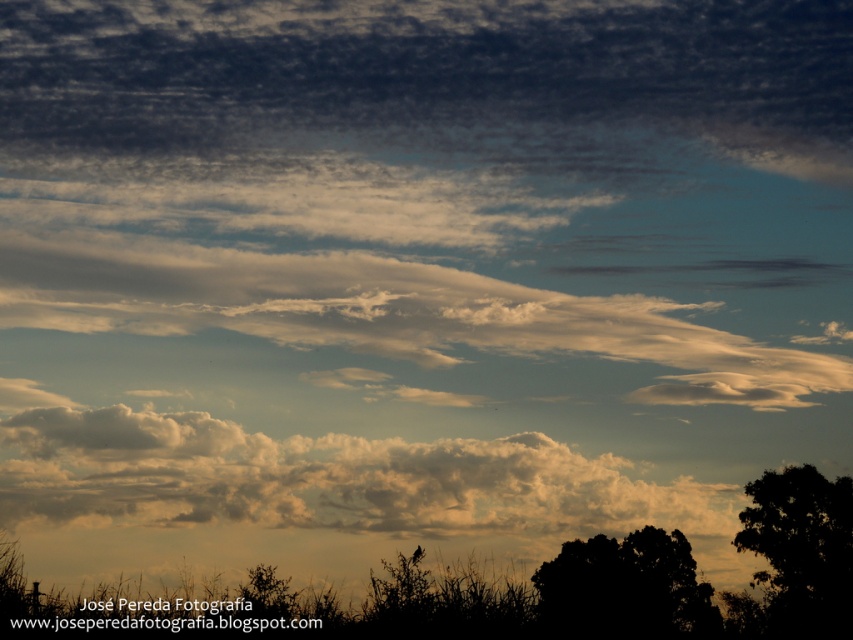
Between dark gray textured cloud at upper center and black matte tree at lower right, which one has more height?

dark gray textured cloud at upper center

Describe the element at coordinates (432, 80) in the screenshot. I see `dark gray textured cloud at upper center` at that location.

You are a GUI agent. You are given a task and a screenshot of the screen. Output one action in this format:
    pyautogui.click(x=<x>, y=<y>)
    Task: Click on the dark gray textured cloud at upper center
    
    Given the screenshot: What is the action you would take?
    pyautogui.click(x=432, y=80)

Between cloudy white at lower center and dark green leafy tree at lower right, which one appears on the left side from the viewer's perspective?

From the viewer's perspective, cloudy white at lower center appears more on the left side.

Is cloudy white at lower center below dark green leafy tree at lower right?

No.

Locate an element on the screen. The image size is (853, 640). cloudy white at lower center is located at coordinates (326, 480).

Between point (281, 102) and point (775, 531), which one is positioned in front?

Point (775, 531) is more forward.

Based on the photo, who is shorter, dark gray textured cloud at upper center or dark green leafy tree at lower right?

Standing shorter between the two is dark green leafy tree at lower right.

Is point (509, 115) positioned before point (810, 604)?

No, it is not.

Identify the location of dark gray textured cloud at upper center. (432, 80).